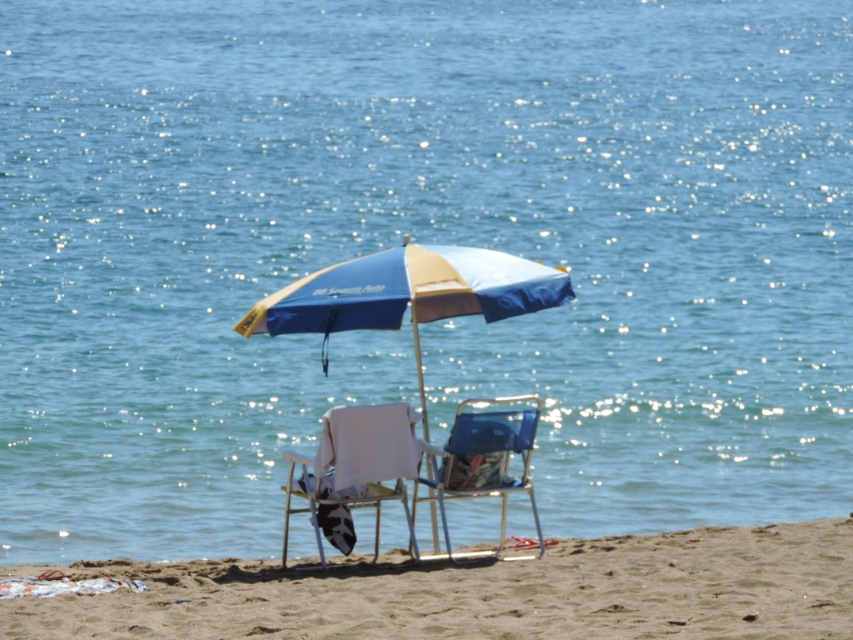
You are a beachgoer who wants to place a cooler between the blue fabric umbrella at center and the white fabric chair at center. If the cooler is 12 inches wide, will there be enough space between them?

The distance between the blue fabric umbrella at center and the white fabric chair at center is 26.06 inches. Since the cooler is 12 inches wide, there is sufficient space to place it between them as 26.06 inches is greater than 12 inches.